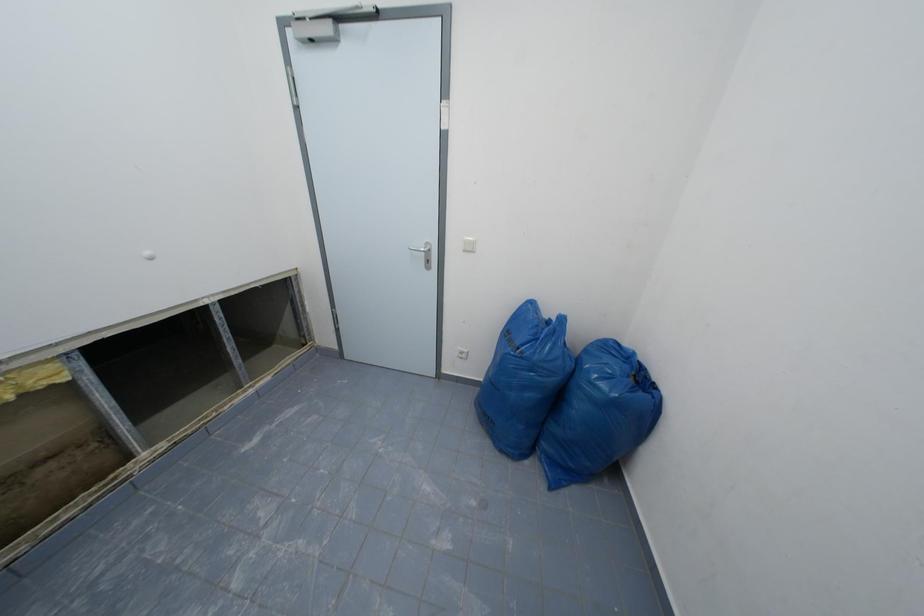
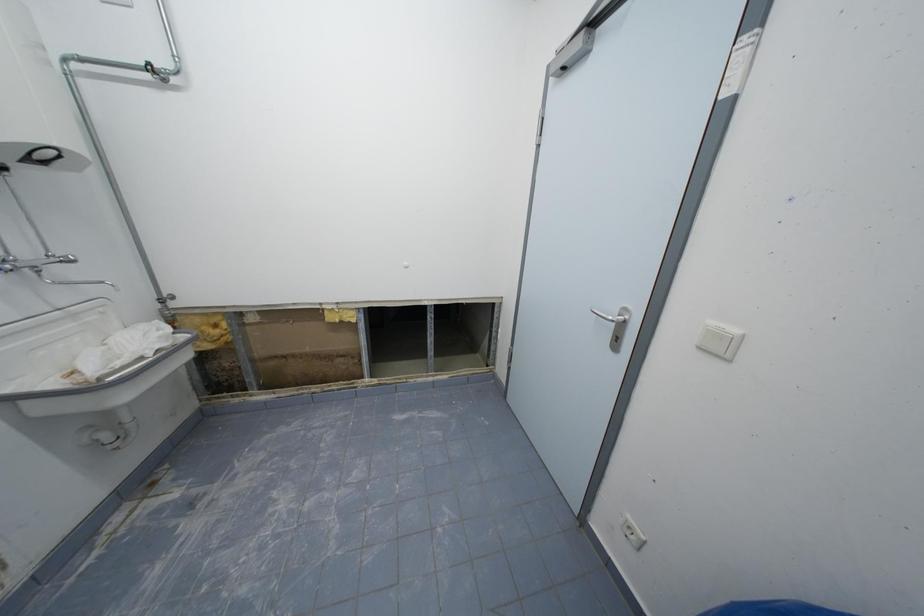
Question: The camera is either moving clockwise (left) or counter-clockwise (right) around the object. The first image is from the beginning of the video and the second image is from the end. Is the camera moving left or right when shooting the video?

Choices:
 (A) Left
 (B) Right

Answer: (B)